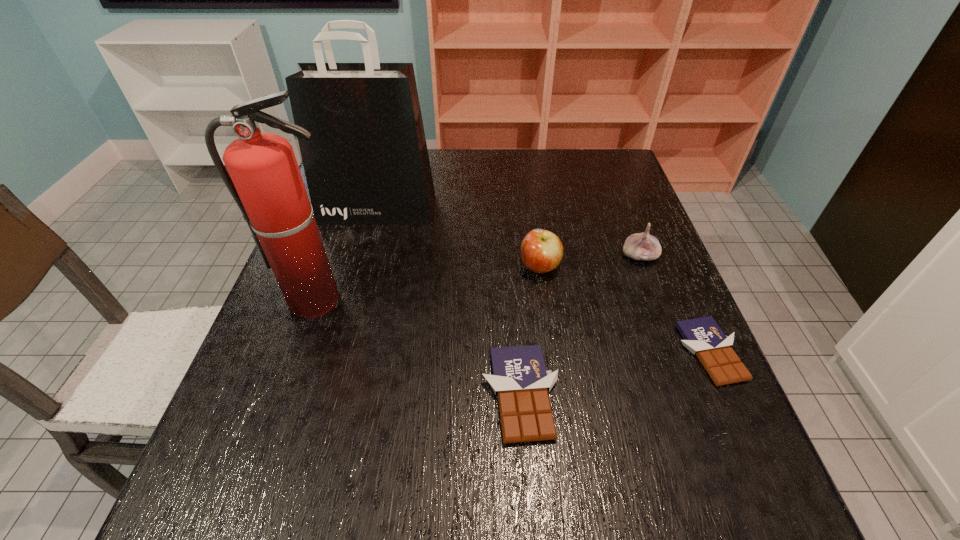
Locate an element on the screen. This screenshot has height=540, width=960. the left chocolate bar is located at coordinates (520, 379).

Identify the location of the taller chocolate bar. This screenshot has width=960, height=540. (520, 379).

You are a GUI agent. You are given a task and a screenshot of the screen. Output one action in this format:
    pyautogui.click(x=<x>, y=<y>)
    Task: Click on the shorter chocolate bar
    
    Given the screenshot: What is the action you would take?
    pyautogui.click(x=703, y=337)

You are a GUI agent. You are given a task and a screenshot of the screen. Output one action in this format:
    pyautogui.click(x=<x>, y=<y>)
    Task: Click on the shortest object
    
    Given the screenshot: What is the action you would take?
    pyautogui.click(x=703, y=337)

In order to click on shopping bag in this screenshot , I will do (366, 163).

Where is `apple`? apple is located at coordinates (541, 251).

Locate an element on the screen. The width and height of the screenshot is (960, 540). fire extinguisher is located at coordinates (265, 181).

The image size is (960, 540). I want to click on garlic, so click(x=640, y=246).

Image resolution: width=960 pixels, height=540 pixels. Find the location of `vacant space located 0.260m on the back of the left chocolate bar`. vacant space located 0.260m on the back of the left chocolate bar is located at coordinates (511, 264).

I want to click on vacant area located 0.200m on the back of the right chocolate bar, so click(666, 258).